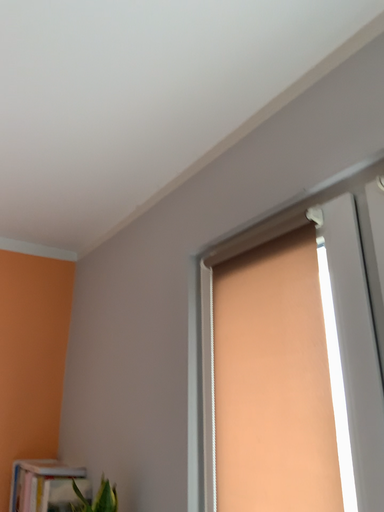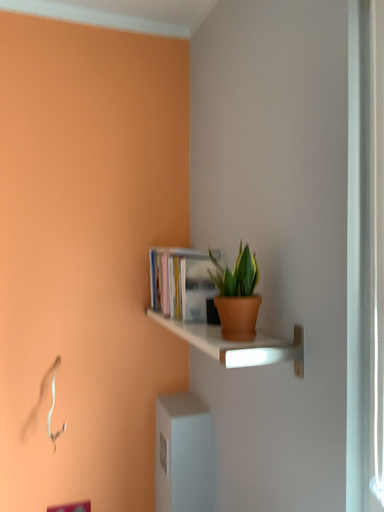
Question: Which way did the camera rotate in the video?

Choices:
 (A) rotated downward
 (B) rotated upward

Answer: (A)